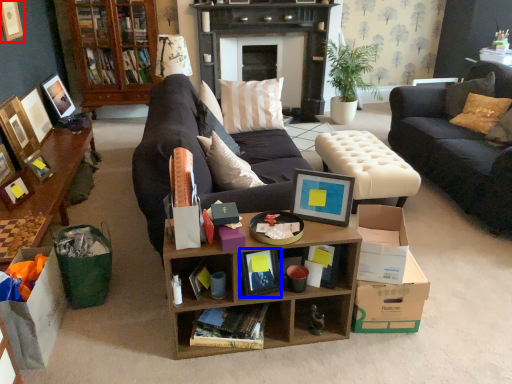
Question: Which point is further to the camera, picture frame (highlighted by a red box) or book (highlighted by a blue box)?

Choices:
 (A) picture frame
 (B) book

Answer: (A)